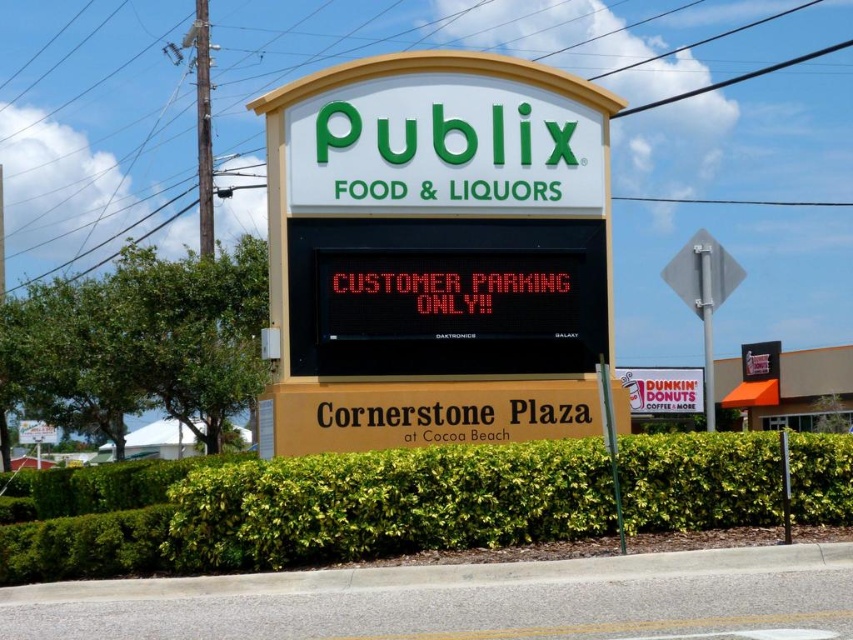
Does green leafy hedge at center have a greater width compared to white paper dunkin' donuts sign at center?

Yes, green leafy hedge at center is wider than white paper dunkin' donuts sign at center.

Who is more forward, (633, 532) or (664, 412)?

Point (633, 532) is more forward.

You are a GUI agent. You are given a task and a screenshot of the screen. Output one action in this format:
    pyautogui.click(x=<x>, y=<y>)
    Task: Click on the green leafy hedge at center
    This screenshot has height=640, width=853.
    Given the screenshot: What is the action you would take?
    pyautogui.click(x=312, y=509)

Which is in front, point (790, 422) or point (651, 396)?

Positioned in front is point (651, 396).

Which is more to the left, orange awning at right or white paper dunkin' donuts sign at center?

white paper dunkin' donuts sign at center is more to the left.

The width and height of the screenshot is (853, 640). What do you see at coordinates (787, 387) in the screenshot? I see `orange awning at right` at bounding box center [787, 387].

Find the location of a particular element. The width and height of the screenshot is (853, 640). orange awning at right is located at coordinates (787, 387).

Is yellow matte sign at center shorter than green leafy hedge at center?

Yes, yellow matte sign at center is shorter than green leafy hedge at center.

Which is behind, point (312, 128) or point (811, 452)?

The point (312, 128) is behind.

Between point (329, 188) and point (637, 465), which one is positioned in front?

Point (637, 465) is more forward.

The width and height of the screenshot is (853, 640). What are the coordinates of `yellow matte sign at center` in the screenshot? It's located at (436, 253).